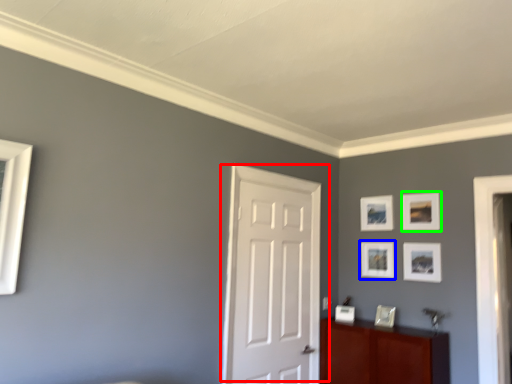
Question: Which object is the farthest from door (highlighted by a red box)? Choose among these: picture frame (highlighted by a blue box) or picture frame (highlighted by a green box).

Choices:
 (A) picture frame
 (B) picture frame

Answer: (B)